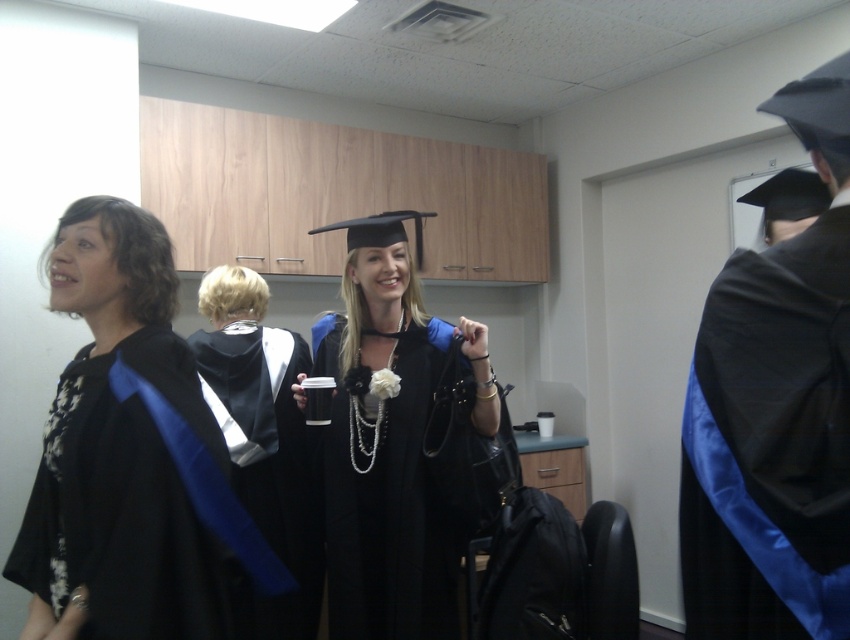
Is the position of black satin graduation robe at right more distant than that of matte black graduation gown at center?

No, black satin graduation robe at right is in front of matte black graduation gown at center.

Is point (833, 387) less distant than point (344, 477)?

Yes, it is in front of point (344, 477).

The width and height of the screenshot is (850, 640). I want to click on black satin graduation robe at right, so click(769, 444).

Can you confirm if black satin graduation robe at right is positioned to the left of satin black gown at center?

Incorrect, black satin graduation robe at right is not on the left side of satin black gown at center.

Is black satin graduation robe at right below satin black gown at center?

Actually, black satin graduation robe at right is above satin black gown at center.

What are the coordinates of `black satin graduation robe at right` in the screenshot? It's located at (769, 444).

The image size is (850, 640). Find the location of `black satin graduation robe at right`. black satin graduation robe at right is located at coordinates (769, 444).

Which is above, black satin gown at left or satin black gown at center?

black satin gown at left is above.

Is point (61, 497) positioned behind point (207, 371)?

No, (61, 497) is in front of (207, 371).

This screenshot has width=850, height=640. Find the location of `black satin gown at left`. black satin gown at left is located at coordinates (131, 456).